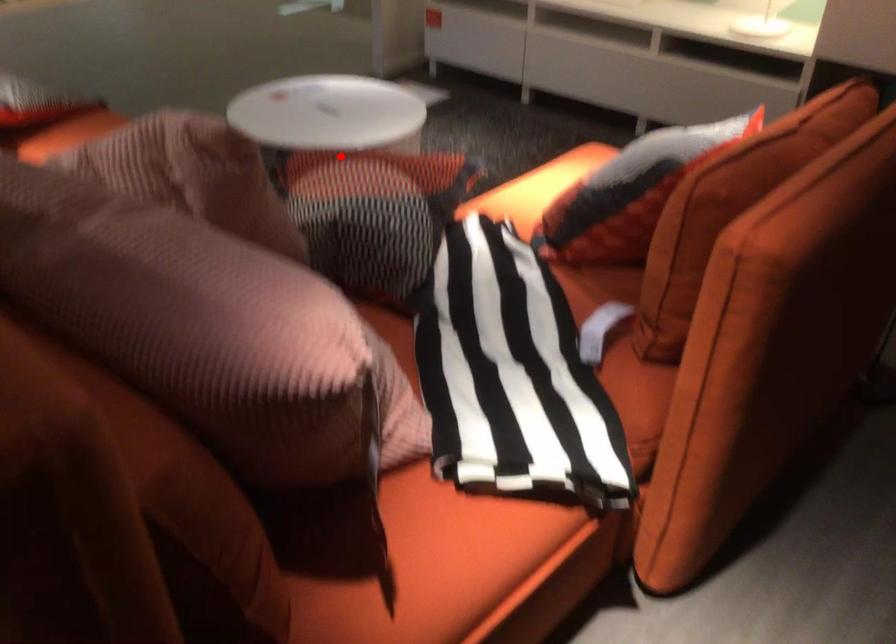
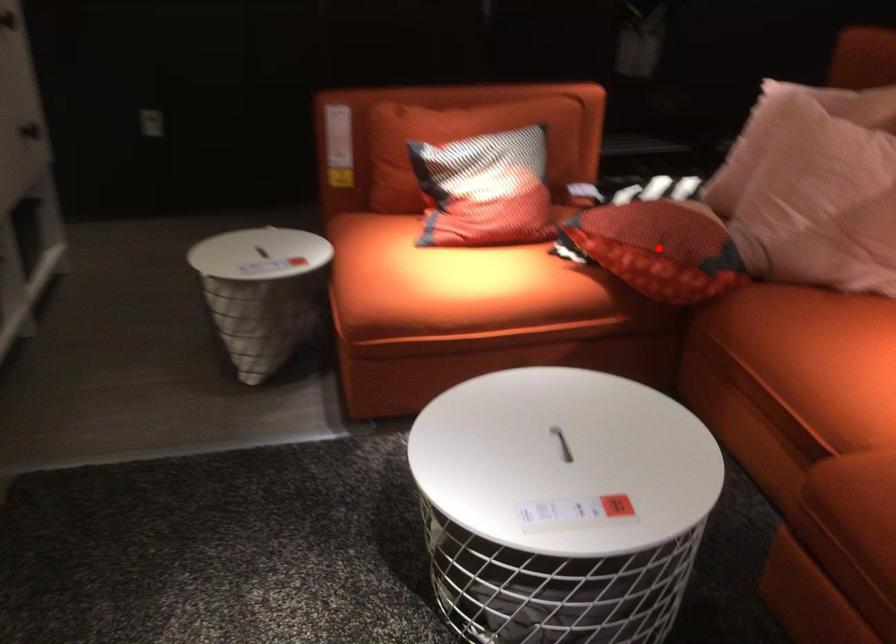
I am providing you with two images of the same scene from different viewpoints. A red point is marked on the first image and another point is marked on the second image. Do the highlighted points in image1 and image2 indicate the same real-world spot?

Yes